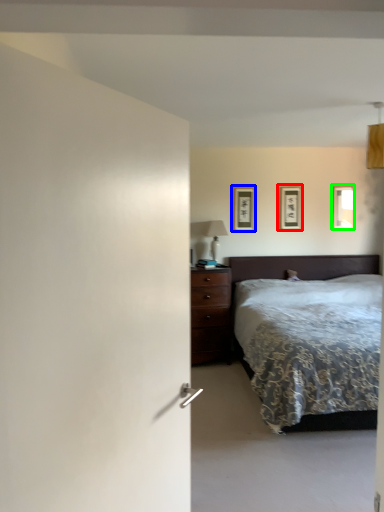
Question: Which object is the farthest from picture frame (highlighted by a red box)? Choose among these: picture frame (highlighted by a blue box) or picture frame (highlighted by a green box).

Choices:
 (A) picture frame
 (B) picture frame

Answer: (B)